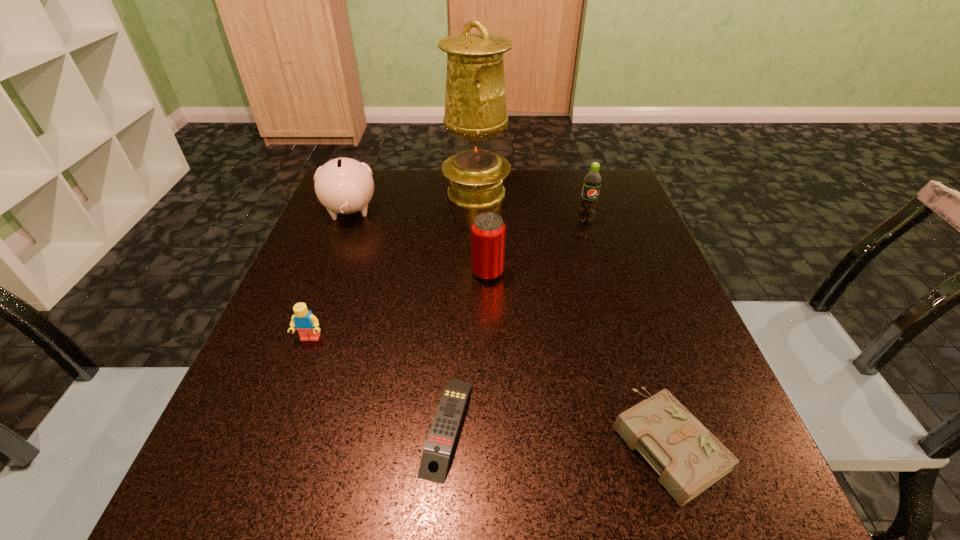
You are a GUI agent. You are given a task and a screenshot of the screen. Output one action in this format:
    pyautogui.click(x=<x>, y=<y>)
    Task: Click on the vacant space at the right edge
    
    Given the screenshot: What is the action you would take?
    pyautogui.click(x=647, y=269)

Identify the location of free point at the far left corner. (392, 172).

Where is `vacant space at the near left corner`? The image size is (960, 540). vacant space at the near left corner is located at coordinates (197, 516).

Locate an element on the screen. The height and width of the screenshot is (540, 960). vacant space at the far right corner of the desktop is located at coordinates (626, 210).

You are a GUI agent. You are given a task and a screenshot of the screen. Output one action in this format:
    pyautogui.click(x=<x>, y=<y>)
    Task: Click on the empty location between the fourth farthest object and the soda
    The width and height of the screenshot is (960, 540).
    Given the screenshot: What is the action you would take?
    pyautogui.click(x=537, y=247)

You are a GUI agent. You are given a task and a screenshot of the screen. Output one action in this format:
    pyautogui.click(x=<x>, y=<y>)
    Task: Click on the vacant space that is in between the piggy bank and the sixth tallest object
    
    Given the screenshot: What is the action you would take?
    pyautogui.click(x=509, y=327)

Identify the location of empty space that is in between the can and the third shortest object. (399, 306).

You are a GUI agent. You are given a task and a screenshot of the screen. Output one action in this format:
    pyautogui.click(x=<x>, y=<y>)
    Task: Click on the blank region between the shortest object and the soda
    Image resolution: width=960 pixels, height=540 pixels.
    Given the screenshot: What is the action you would take?
    pyautogui.click(x=516, y=323)

The image size is (960, 540). Identify the location of free space between the piggy bank and the can. (419, 242).

Find the location of `vacant point located between the fourth nearest object and the Lego`. vacant point located between the fourth nearest object and the Lego is located at coordinates (399, 306).